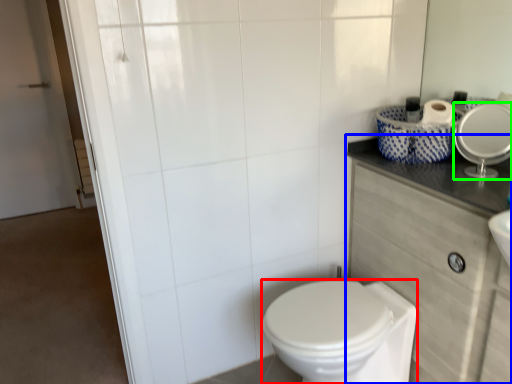
Question: Estimate the real-world distances between objects in this image. Which object is closer to bidet (highlighted by a red box), counter top (highlighted by a blue box) or mirror (highlighted by a green box)?

Choices:
 (A) counter top
 (B) mirror

Answer: (A)